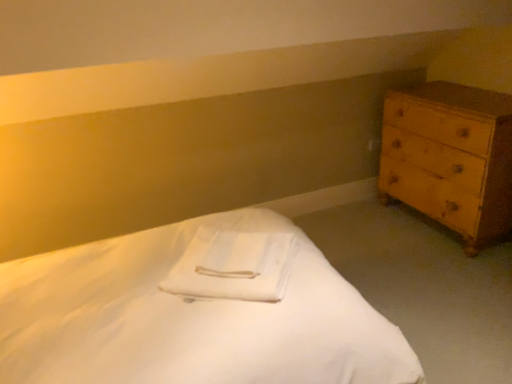
Question: Are light brown wooden chest of drawers at right and white soft towel at center beside each other?

Choices:
 (A) yes
 (B) no

Answer: (B)

Question: Is light brown wooden chest of drawers at right further to camera compared to white soft towel at center?

Choices:
 (A) yes
 (B) no

Answer: (A)

Question: Does light brown wooden chest of drawers at right have a greater width compared to white soft towel at center?

Choices:
 (A) yes
 (B) no

Answer: (A)

Question: Is light brown wooden chest of drawers at right not within white soft towel at center?

Choices:
 (A) yes
 (B) no

Answer: (A)

Question: Considering the relative sizes of light brown wooden chest of drawers at right and white soft towel at center in the image provided, is light brown wooden chest of drawers at right thinner than white soft towel at center?

Choices:
 (A) yes
 (B) no

Answer: (B)

Question: Is white soft towel at center wider or thinner than light brown wooden chest of drawers at right?

Choices:
 (A) thin
 (B) wide

Answer: (A)

Question: Is point (200, 226) closer or farther from the camera than point (433, 99)?

Choices:
 (A) farther
 (B) closer

Answer: (B)

Question: Is white soft towel at center taller or shorter than light brown wooden chest of drawers at right?

Choices:
 (A) short
 (B) tall

Answer: (A)

Question: Visually, is white soft towel at center positioned to the left or to the right of light brown wooden chest of drawers at right?

Choices:
 (A) left
 (B) right

Answer: (A)

Question: In terms of height, does white soft towel at center look taller or shorter compared to white smooth bed at center?

Choices:
 (A) tall
 (B) short

Answer: (B)

Question: Based on their positions, is white soft towel at center located to the left or right of white smooth bed at center?

Choices:
 (A) right
 (B) left

Answer: (A)

Question: Is point (225, 254) positioned closer to the camera than point (53, 379)?

Choices:
 (A) farther
 (B) closer

Answer: (A)

Question: Considering the positions of white soft towel at center and white smooth bed at center in the image, is white soft towel at center bigger or smaller than white smooth bed at center?

Choices:
 (A) small
 (B) big

Answer: (A)

Question: Based on their positions, is white smooth bed at center located to the left or right of light brown wooden chest of drawers at right?

Choices:
 (A) left
 (B) right

Answer: (A)

Question: Relative to light brown wooden chest of drawers at right, is white smooth bed at center in front or behind?

Choices:
 (A) behind
 (B) front

Answer: (B)